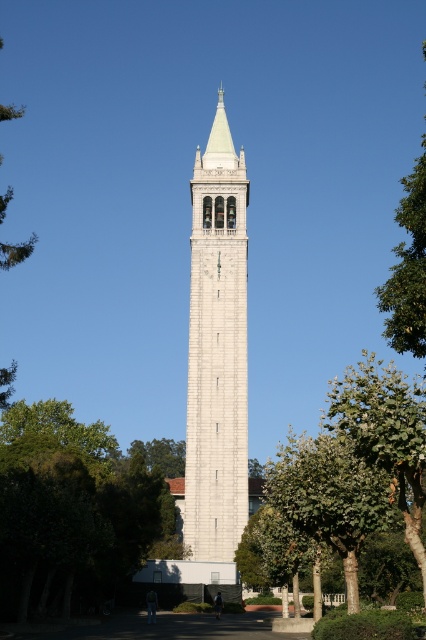
Measure the distance between white stone bell tower at center and camera.

A distance of 103.15 meters exists between white stone bell tower at center and camera.

Does white stone bell tower at center appear over green leafy tree at upper right?

Incorrect, white stone bell tower at center is not positioned above green leafy tree at upper right.

Who is more forward, (224, 387) or (423, 292)?

Point (423, 292) is more forward.

This screenshot has height=640, width=426. Identify the location of white stone bell tower at center. (216, 349).

Can you confirm if green leafy tree at lower left is wider than green leafy tree at upper right?

Yes.

Is green leafy tree at lower left closer to the viewer compared to green leafy tree at upper right?

That is False.

The image size is (426, 640). What are the coordinates of `green leafy tree at lower left` in the screenshot? It's located at (74, 508).

Which is below, green leafy tree at lower left or green leafy tree at center?

green leafy tree at lower left is lower down.

Who is taller, green leafy tree at lower left or green leafy tree at center?

green leafy tree at center is taller.

Who is more distant from viewer, (45, 531) or (396, 394)?

Positioned behind is point (45, 531).

Find the location of a particular element. This screenshot has height=640, width=426. green leafy tree at lower left is located at coordinates (74, 508).